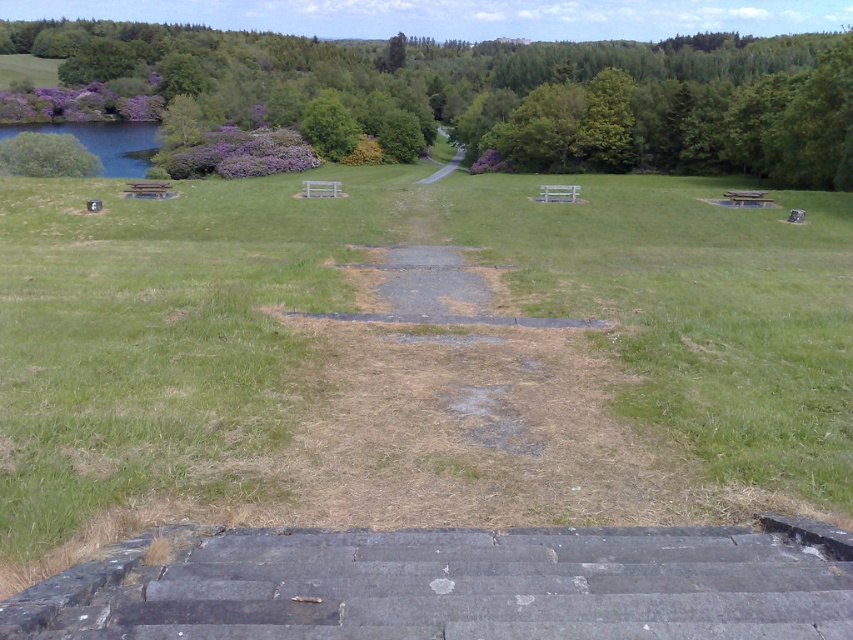
The height and width of the screenshot is (640, 853). What do you see at coordinates (506, 92) in the screenshot? I see `purple leafy tree at upper left` at bounding box center [506, 92].

Between point (589, 145) and point (27, 140), which one is positioned in front?

Point (27, 140) is more forward.

Which is in front, point (627, 148) or point (41, 163)?

Point (41, 163)

Locate an element on the screen. This screenshot has width=853, height=640. purple leafy tree at upper left is located at coordinates (506, 92).

Does dark gray stone stairs at lower center have a greater height compared to gravel path at center?

No.

From the picture: Does dark gray stone stairs at lower center appear on the right side of gravel path at center?

No, dark gray stone stairs at lower center is not to the right of gravel path at center.

Which is behind, point (802, 625) or point (450, 168)?

Positioned behind is point (450, 168).

Identify the location of dark gray stone stairs at lower center. (454, 586).

Between dark gray stone stairs at lower center and purple leafy tree at upper left, which one is positioned higher?

purple leafy tree at upper left

Can you confirm if dark gray stone stairs at lower center is positioned to the left of purple leafy tree at upper left?

Indeed, dark gray stone stairs at lower center is positioned on the left side of purple leafy tree at upper left.

Which is behind, point (144, 570) or point (392, 88)?

Positioned behind is point (392, 88).

Where is `dark gray stone stairs at lower center`? This screenshot has height=640, width=853. dark gray stone stairs at lower center is located at coordinates (454, 586).